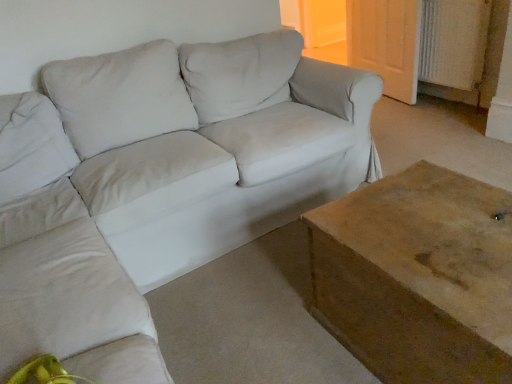
Question: Is light beige fabric couch at center not close to wooden table at lower right?

Choices:
 (A) no
 (B) yes

Answer: (A)

Question: From a real-world perspective, is light beige fabric couch at center located higher than wooden table at lower right?

Choices:
 (A) yes
 (B) no

Answer: (A)

Question: Considering the relative sizes of light beige fabric couch at center and wooden table at lower right in the image provided, is light beige fabric couch at center wider than wooden table at lower right?

Choices:
 (A) no
 (B) yes

Answer: (B)

Question: Is light beige fabric couch at center smaller than wooden table at lower right?

Choices:
 (A) no
 (B) yes

Answer: (A)

Question: Is light beige fabric couch at center closer to camera compared to wooden table at lower right?

Choices:
 (A) yes
 (B) no

Answer: (B)

Question: Is light beige fabric couch at center placed right next to wooden table at lower right?

Choices:
 (A) no
 (B) yes

Answer: (A)

Question: Considering the relative positions of wooden door at upper right and light beige fabric couch at center in the image provided, is wooden door at upper right to the left of light beige fabric couch at center from the viewer's perspective?

Choices:
 (A) yes
 (B) no

Answer: (B)

Question: Considering the relative positions of wooden door at upper right and light beige fabric couch at center in the image provided, is wooden door at upper right in front of light beige fabric couch at center?

Choices:
 (A) yes
 (B) no

Answer: (B)

Question: From a real-world perspective, is wooden door at upper right located higher than light beige fabric couch at center?

Choices:
 (A) no
 (B) yes

Answer: (A)

Question: Does wooden door at upper right appear on the right side of light beige fabric couch at center?

Choices:
 (A) yes
 (B) no

Answer: (A)

Question: Is wooden door at upper right surrounding light beige fabric couch at center?

Choices:
 (A) yes
 (B) no

Answer: (B)

Question: From a real-world perspective, is wooden door at upper right positioned under light beige fabric couch at center based on gravity?

Choices:
 (A) yes
 (B) no

Answer: (A)

Question: Would you consider white textured radiator at upper right to be distant from light beige fabric couch at center?

Choices:
 (A) yes
 (B) no

Answer: (A)